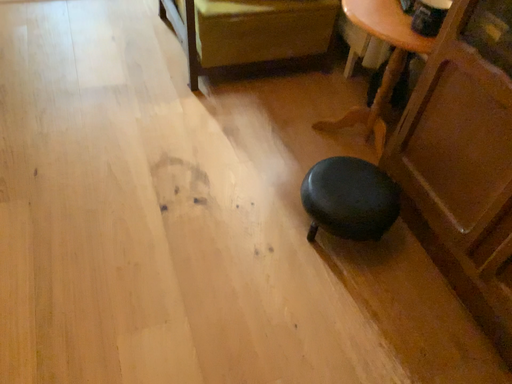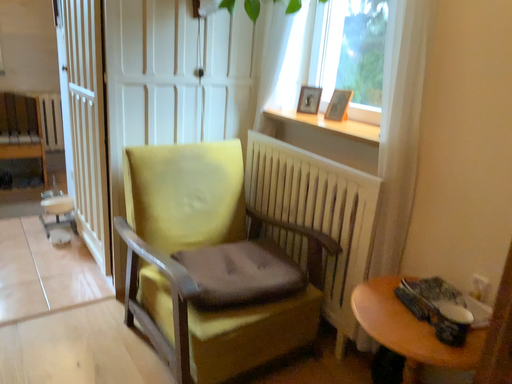
Question: Which way did the camera rotate in the video?

Choices:
 (A) rotated downward
 (B) rotated upward

Answer: (B)